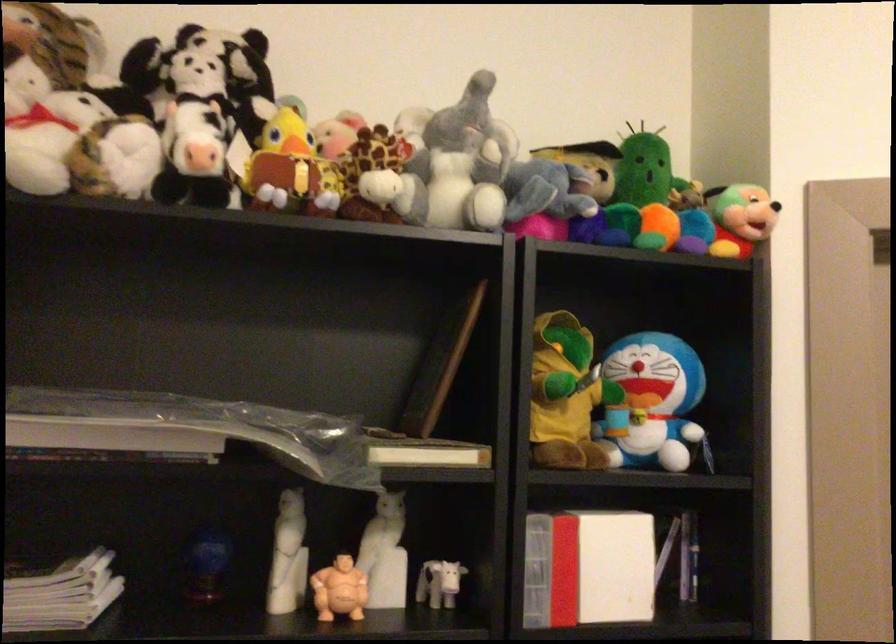
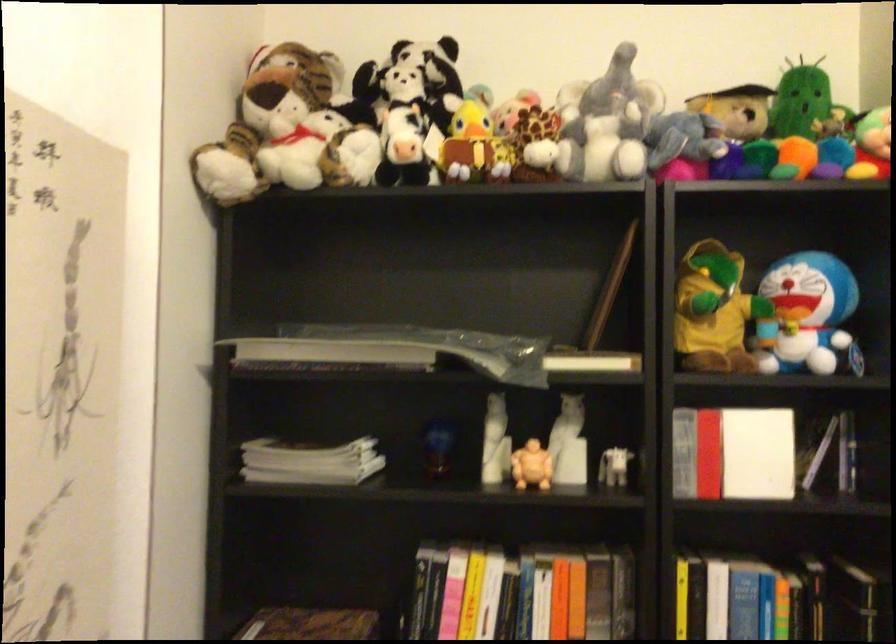
The point at (566, 393) is marked in the first image. Where is the corresponding point in the second image?

(713, 310)